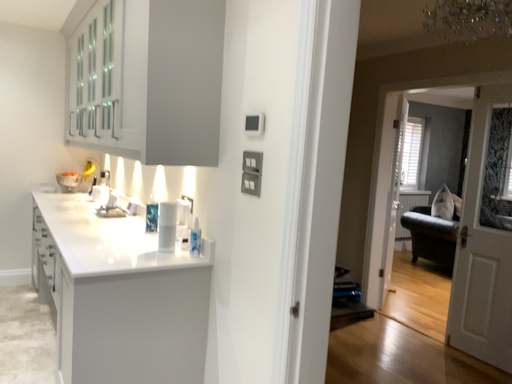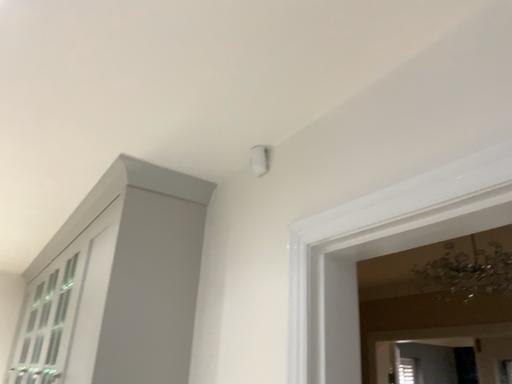
Question: How did the camera likely rotate when shooting the video?

Choices:
 (A) rotated downward
 (B) rotated upward

Answer: (B)